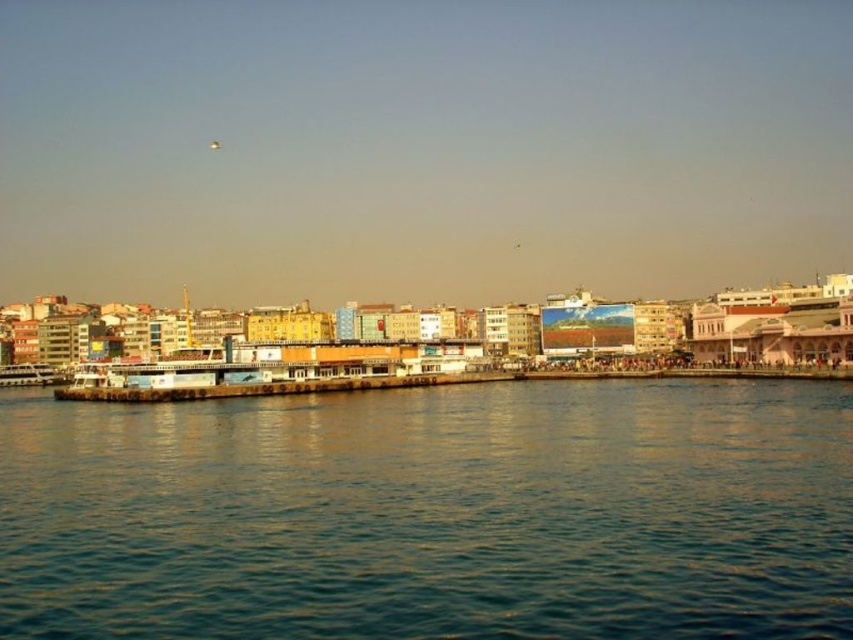
Does blue water at lower center have a greater width compared to white matte boat at lower left?

Correct, the width of blue water at lower center exceeds that of white matte boat at lower left.

Is blue water at lower center below white matte boat at lower left?

Yes.

Identify the location of blue water at lower center. This screenshot has height=640, width=853. (433, 513).

This screenshot has width=853, height=640. I want to click on blue water at lower center, so click(x=433, y=513).